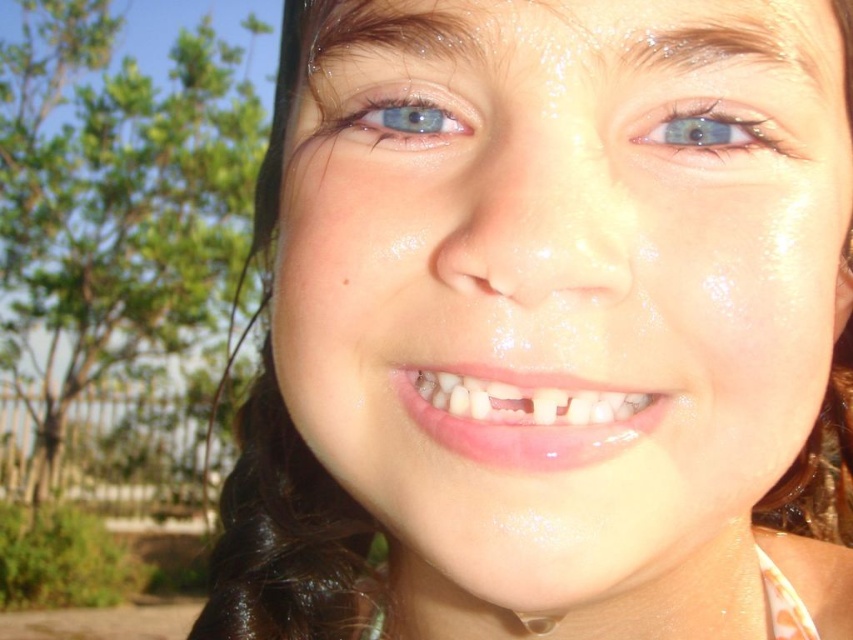
Is smooth skin face at center smaller than blue glossy eye at upper center?

Incorrect, smooth skin face at center is not smaller in size than blue glossy eye at upper center.

This screenshot has height=640, width=853. I want to click on smooth skin face at center, so pyautogui.click(x=566, y=296).

Is smooth skin face at center smaller than blue glossy eye at upper right?

Incorrect, smooth skin face at center is not smaller in size than blue glossy eye at upper right.

Does smooth skin face at center have a lesser width compared to blue glossy eye at upper right?

No, smooth skin face at center is not thinner than blue glossy eye at upper right.

Measure the distance between point (310, 260) and camera.

They are 28.89 centimeters apart.

This screenshot has width=853, height=640. What are the coordinates of `smooth skin face at center` in the screenshot? It's located at (566, 296).

Between point (724, 109) and point (370, 115), which one is positioned in front?

Positioned in front is point (724, 109).

How far apart are blue glossy eye at upper right and blue glossy eye at upper center?

They are 3.32 inches apart.

Does point (682, 109) come behind point (418, 86)?

No, it is in front of (418, 86).

Find the location of a particular element. The height and width of the screenshot is (640, 853). blue glossy eye at upper right is located at coordinates (712, 131).